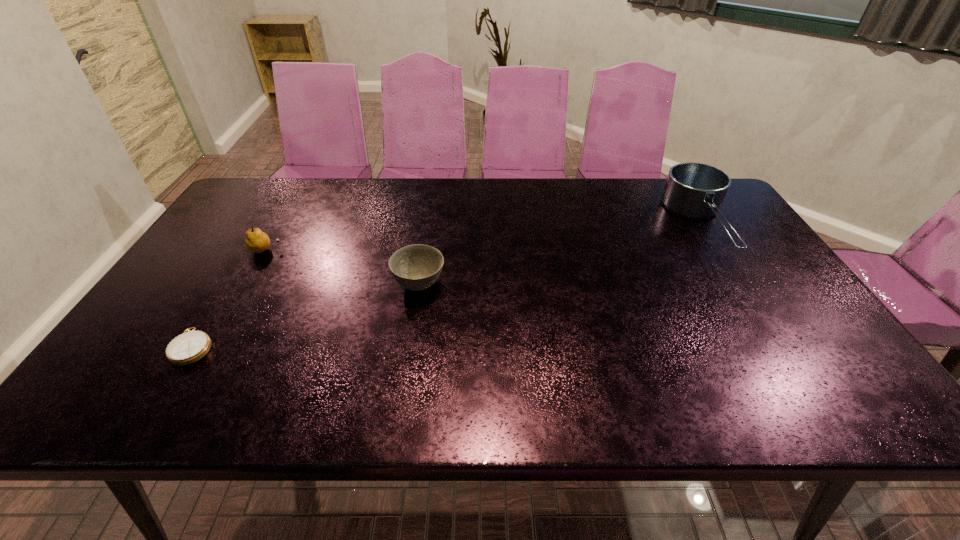
Find the location of a particular element. The height and width of the screenshot is (540, 960). object that is the second closest one to the third object from left to right is located at coordinates (189, 347).

Point out which object is positioned as the nearest to the compass. Please provide its 2D coordinates. Your answer should be formatted as a tuple, i.e. [(x, y)], where the tuple contains the x and y coordinates of a point satisfying the conditions above.

[(257, 241)]

The image size is (960, 540). In order to click on free space that satisfies the following two spatial constraints: 1. on the front side of the second object from right to left; 2. on the left side of the pear in this screenshot , I will do `click(247, 284)`.